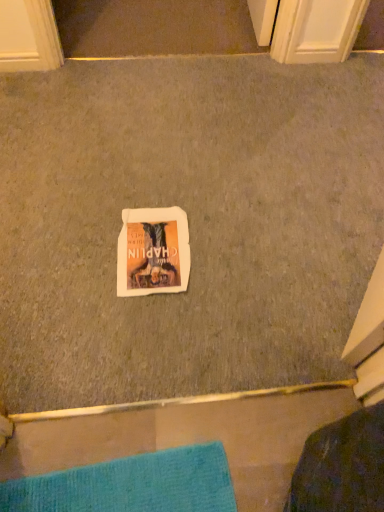
This screenshot has width=384, height=512. What do you see at coordinates (189, 224) in the screenshot? I see `white paper towel at center` at bounding box center [189, 224].

Identify the location of white paper towel at center. The image size is (384, 512). (189, 224).

Locate an element on the screen. This screenshot has height=512, width=384. white paper towel at center is located at coordinates (189, 224).